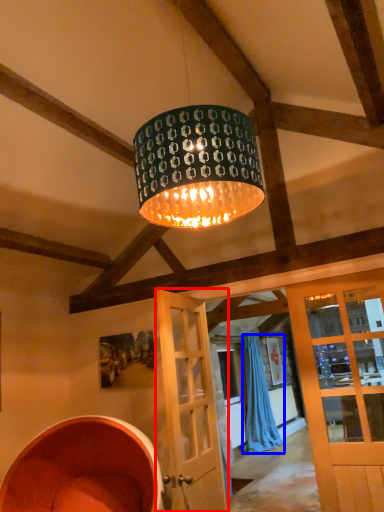
Question: Which of the following is the closest to the observer, door (highlighted by a red box) or curtain (highlighted by a blue box)?

Choices:
 (A) door
 (B) curtain

Answer: (A)